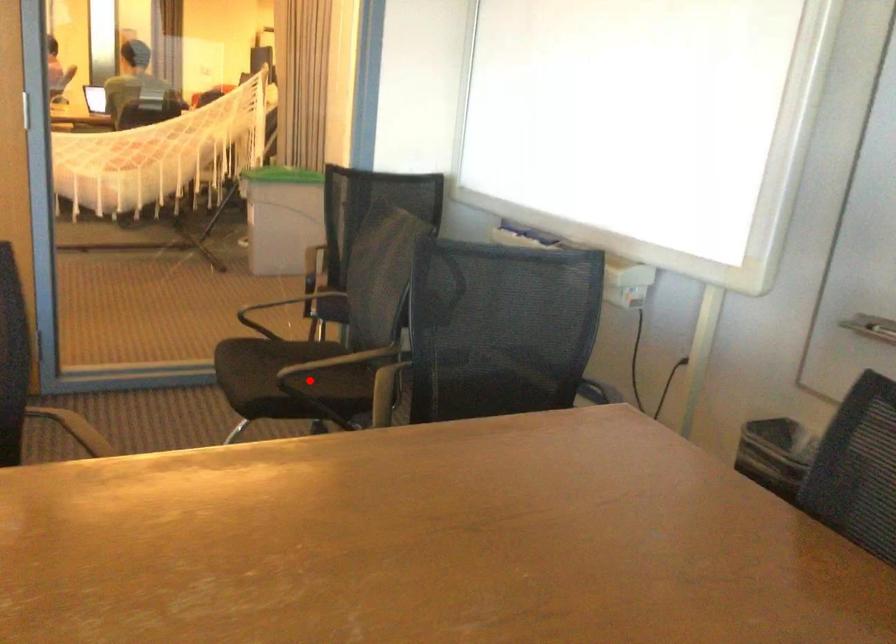
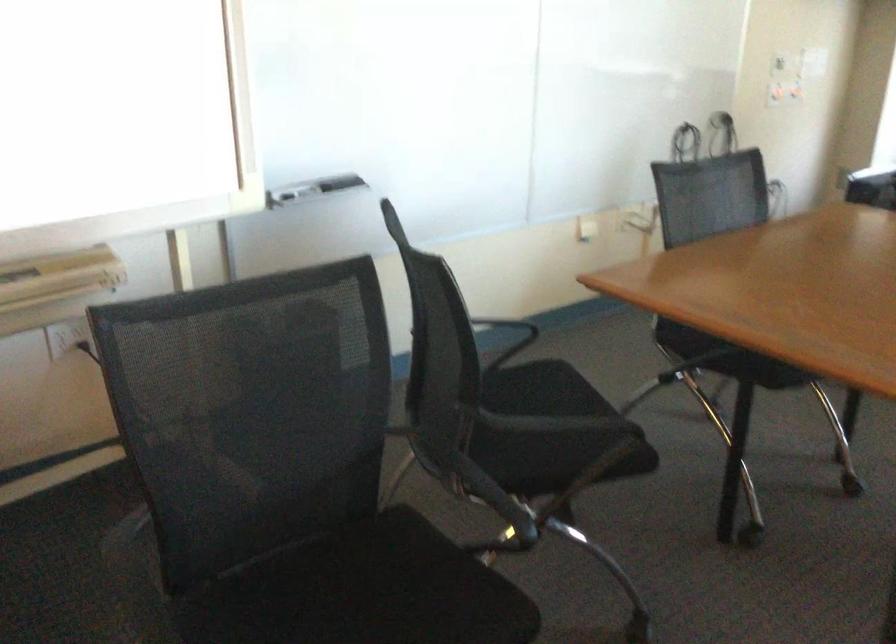
In the second image, find the point that corresponds to the highlighted location in the first image.

(363, 592)